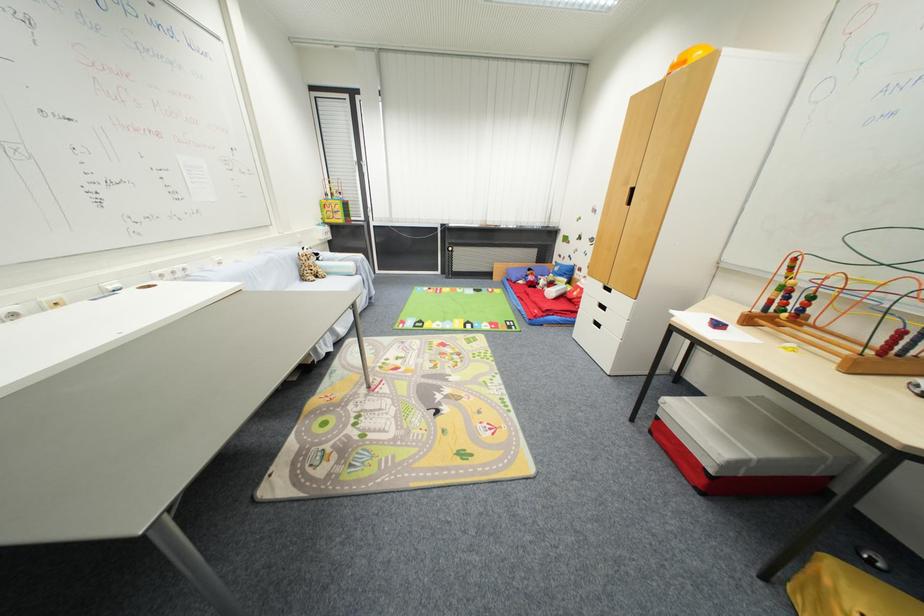
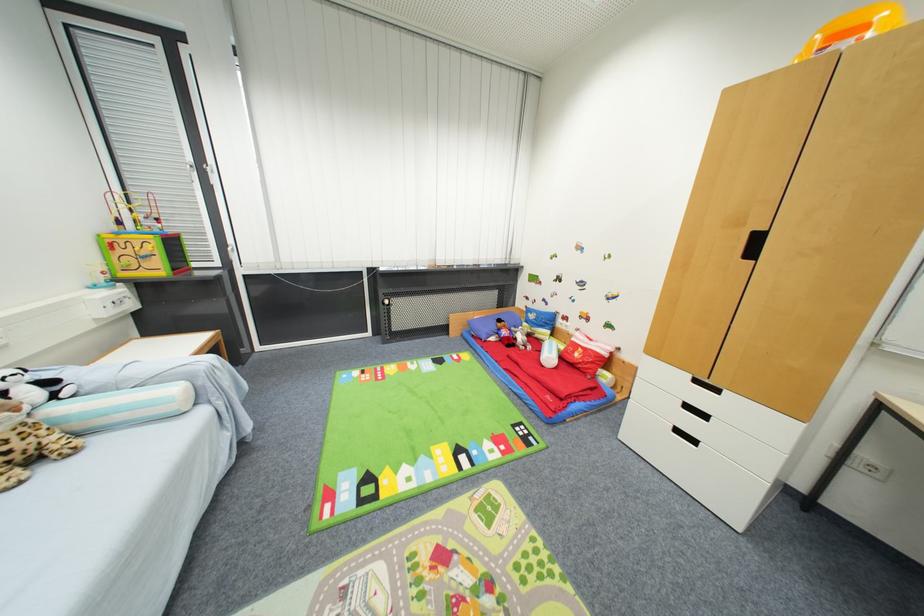
Question: In a continuous first-person perspective shot, in which direction is the camera moving?

Choices:
 (A) Left
 (B) Right
 (C) Forward
 (D) Backward

Answer: (C)